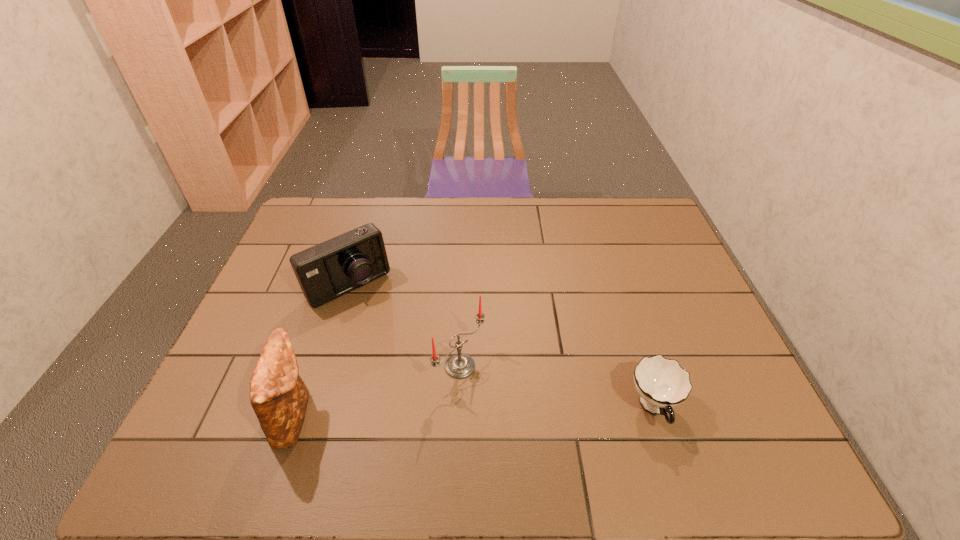
In order to click on clutch bag in this screenshot , I will do `click(279, 397)`.

I want to click on cup, so click(662, 383).

Where is `the rightmost object`? This screenshot has height=540, width=960. the rightmost object is located at coordinates (662, 383).

This screenshot has width=960, height=540. Identify the location of the farthest object. (326, 271).

Where is `candle`? The height and width of the screenshot is (540, 960). candle is located at coordinates coord(459,365).

This screenshot has width=960, height=540. In order to click on vacant space located on the open side of the clutch bag in this screenshot , I will do `click(454, 416)`.

Where is `vacant space located on the front-facing side of the farthest object`? The height and width of the screenshot is (540, 960). vacant space located on the front-facing side of the farthest object is located at coordinates (428, 390).

In order to click on vacant space located on the front-facing side of the farthest object in this screenshot , I will do `click(406, 360)`.

Locate an element on the screen. The image size is (960, 540). vacant space located 0.170m on the front-facing side of the farthest object is located at coordinates (396, 344).

Identify the location of vacant space positioned 0.100m on the front-facing side of the candle. The height and width of the screenshot is (540, 960). (514, 404).